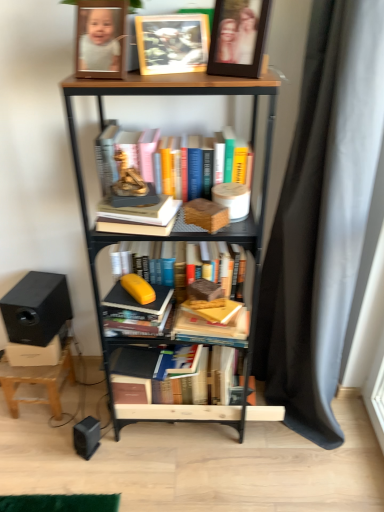
The height and width of the screenshot is (512, 384). I want to click on free space below wooden stool at lower left (from a real-world perspective), so click(x=62, y=399).